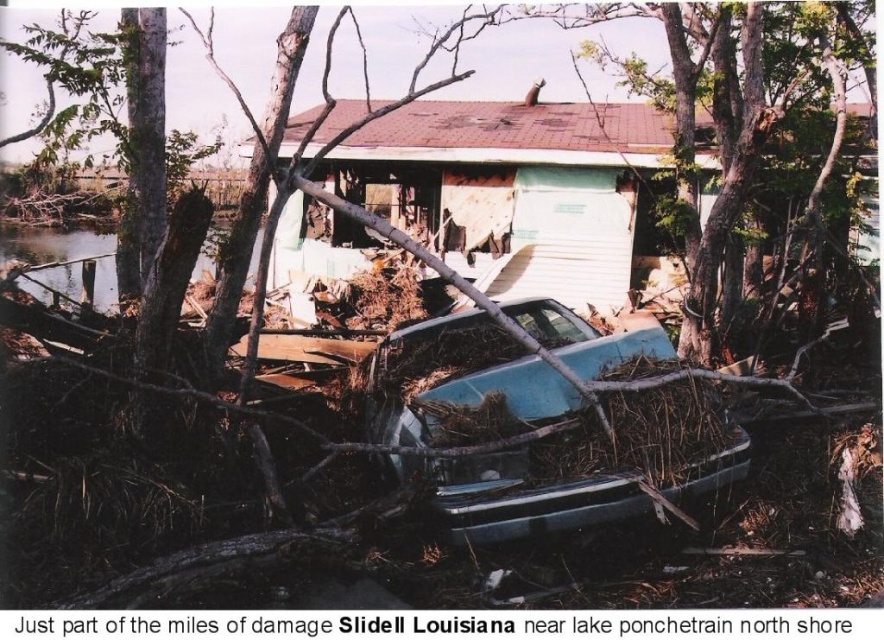
Is point (442, 128) farther from camera compared to point (530, 376)?

Yes, point (442, 128) is behind point (530, 376).

Does white painted wood house at center appear over teal matte car at center?

Indeed, white painted wood house at center is positioned over teal matte car at center.

Locate an element on the screen. The image size is (884, 640). white painted wood house at center is located at coordinates (514, 188).